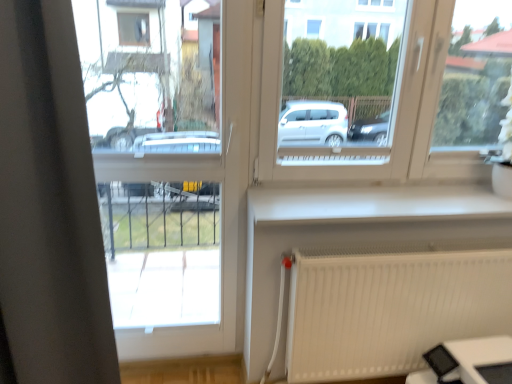
Question: Considering the positions of white plastic window at center and white smooth window sill at center in the image, is white plastic window at center bigger or smaller than white smooth window sill at center?

Choices:
 (A) big
 (B) small

Answer: (A)

Question: Based on their positions, is white plastic window at center located to the left or right of white smooth window sill at center?

Choices:
 (A) left
 (B) right

Answer: (A)

Question: Which of these objects is positioned closest to the white plastic window frame at left?

Choices:
 (A) white smooth window sill at center
 (B) white plastic window at center

Answer: (B)

Question: Considering the real-world distances, which object is closest to the white plastic window frame at left?

Choices:
 (A) white smooth window sill at center
 (B) white plastic window at center

Answer: (B)